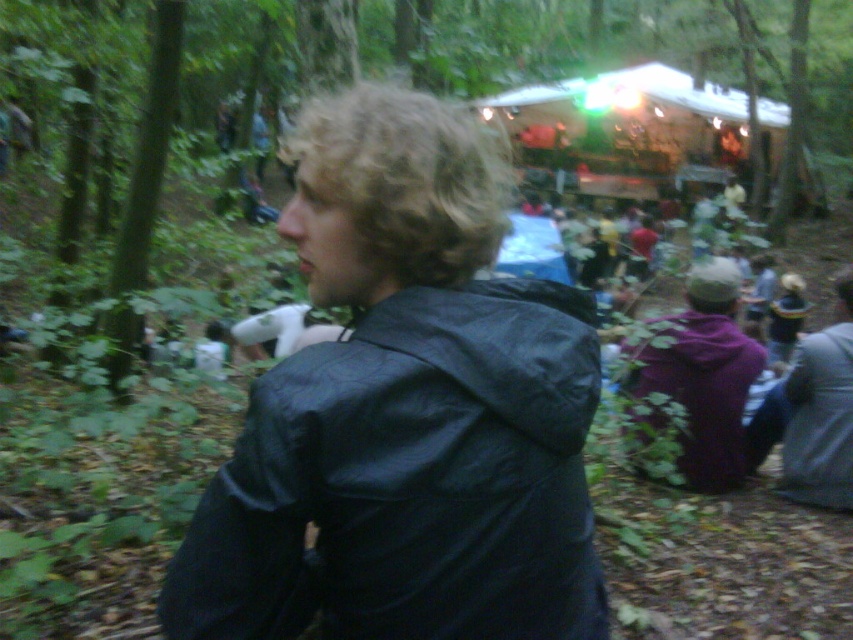
Is black matte jacket at center positioned at the back of shiny gold hat at center?

No, it is in front of shiny gold hat at center.

Can you confirm if black matte jacket at center is bigger than shiny gold hat at center?

No, black matte jacket at center is not bigger than shiny gold hat at center.

Between point (462, 512) and point (773, 333), which one is positioned in front?

Point (462, 512) is in front.

Locate an element on the screen. The image size is (853, 640). black matte jacket at center is located at coordinates (409, 481).

Does curly blonde hair at upper left have a larger size compared to shiny gold hat at center?

Yes.

Is point (364, 120) less distant than point (805, 301)?

Yes, point (364, 120) is in front of point (805, 301).

Where is `curly blonde hair at upper left`? This screenshot has height=640, width=853. curly blonde hair at upper left is located at coordinates (409, 177).

Which is below, black matte jacket at center or purple fleece jacket at lower right?

purple fleece jacket at lower right is below.

Who is shorter, black matte jacket at center or purple fleece jacket at lower right?

black matte jacket at center

Identify the location of black matte jacket at center. The height and width of the screenshot is (640, 853). (409, 481).

At what (x,y) coordinates should I click in order to perform the action: click on black matte jacket at center. Please return your answer as a coordinate pair (x, y). Looking at the image, I should click on (409, 481).